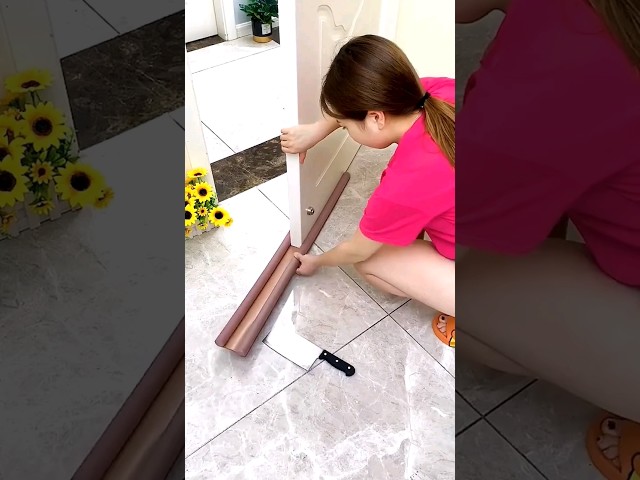
Find the location of a particular element. black pot is located at coordinates (259, 31).